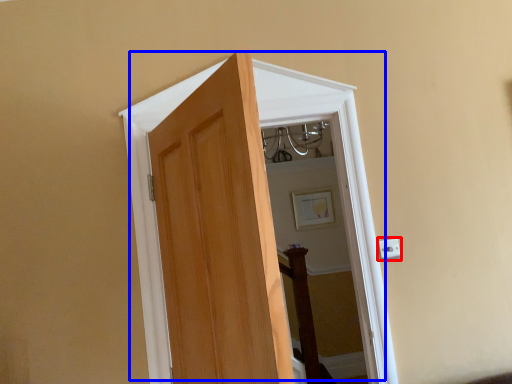
Question: Which object is further to the camera taking this photo, electric outlet (highlighted by a red box) or door (highlighted by a blue box)?

Choices:
 (A) electric outlet
 (B) door

Answer: (A)